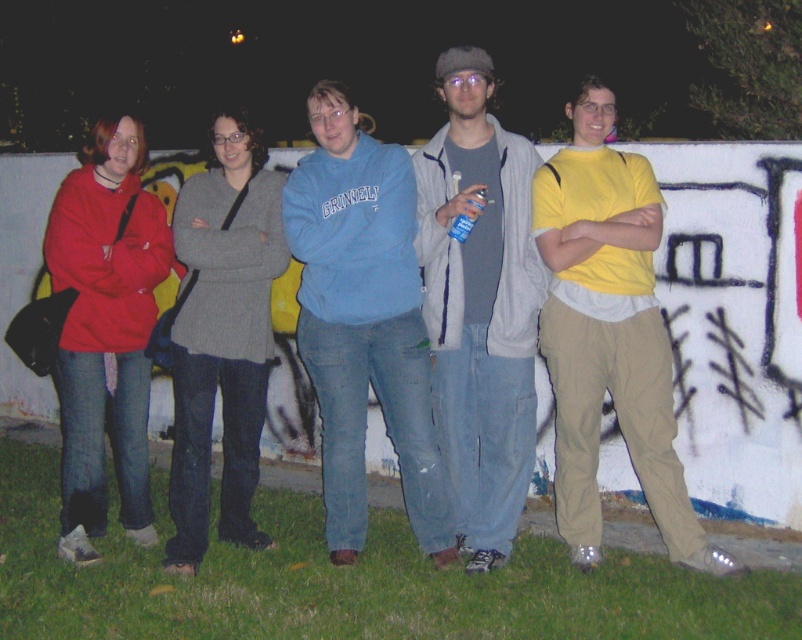
Who is more distant from viewer, (327, 134) or (432, 188)?

The point (432, 188) is behind.

Is blue sweatshirt at center smaller than matte gray jacket at center?

No.

The image size is (802, 640). I want to click on blue sweatshirt at center, so click(x=363, y=321).

Is yellow cotton shirt at center to the right of blue sweatshirt at center from the viewer's perspective?

Yes, yellow cotton shirt at center is to the right of blue sweatshirt at center.

Which is behind, point (566, 164) or point (375, 353)?

The point (566, 164) is behind.

Which is behind, point (618, 403) or point (294, 208)?

The point (294, 208) is more distant.

You are a GUI agent. You are given a task and a screenshot of the screen. Output one action in this format:
    pyautogui.click(x=<x>, y=<y>)
    Task: Click on the yellow cotton shirt at center
    Image resolution: width=802 pixels, height=640 pixels.
    Given the screenshot: What is the action you would take?
    pos(608,333)

Between yellow cotton shirt at center and matte gray jacket at center, which one is positioned lower?

yellow cotton shirt at center

In the scene shown: Is yellow cotton shirt at center to the left of matte gray jacket at center from the viewer's perspective?

In fact, yellow cotton shirt at center is to the right of matte gray jacket at center.

This screenshot has height=640, width=802. In order to click on yellow cotton shirt at center in this screenshot , I will do click(608, 333).

Find the location of a particular element. yellow cotton shirt at center is located at coordinates (608, 333).